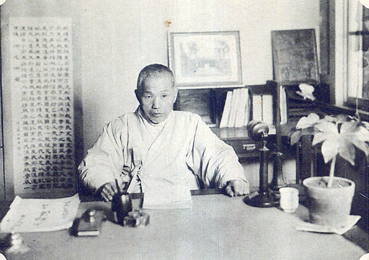
The width and height of the screenshot is (369, 260). Identify the location of desk. (249, 257).